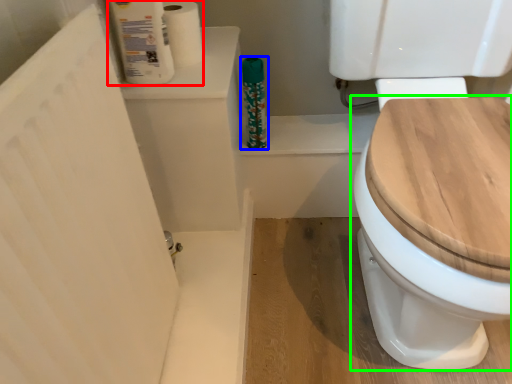
Question: Which object is positioned closest to toilet paper (highlighted by a red box)? Select from cleaning product (highlighted by a blue box) and toilet (highlighted by a green box).

Choices:
 (A) cleaning product
 (B) toilet

Answer: (A)